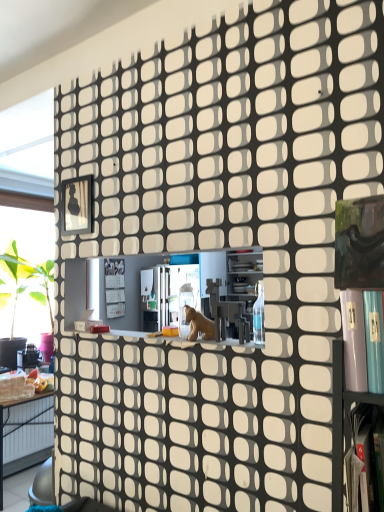
Question: Should I look upward or downward to see metallic frame at upper left?

Choices:
 (A) down
 (B) up

Answer: (B)

Question: Does brown matte animal at center turn towards metallic frame at upper left?

Choices:
 (A) no
 (B) yes

Answer: (A)

Question: Is brown matte animal at center placed right next to metallic frame at upper left?

Choices:
 (A) no
 (B) yes

Answer: (A)

Question: Does brown matte animal at center appear on the right side of metallic frame at upper left?

Choices:
 (A) yes
 (B) no

Answer: (A)

Question: Could metallic frame at upper left be considered to be inside brown matte animal at center?

Choices:
 (A) no
 (B) yes

Answer: (A)

Question: Is brown matte animal at center smaller than metallic frame at upper left?

Choices:
 (A) no
 (B) yes

Answer: (A)

Question: Is there a large distance between brown matte animal at center and metallic frame at upper left?

Choices:
 (A) no
 (B) yes

Answer: (A)

Question: Considering the relative sizes of metallic silver shelf at lower right and metallic frame at upper left in the image provided, is metallic silver shelf at lower right shorter than metallic frame at upper left?

Choices:
 (A) no
 (B) yes

Answer: (A)

Question: Is the surface of metallic silver shelf at lower right in direct contact with metallic frame at upper left?

Choices:
 (A) no
 (B) yes

Answer: (A)

Question: From the image's perspective, does metallic silver shelf at lower right appear lower than metallic frame at upper left?

Choices:
 (A) no
 (B) yes

Answer: (B)

Question: Considering the relative sizes of metallic silver shelf at lower right and metallic frame at upper left in the image provided, is metallic silver shelf at lower right smaller than metallic frame at upper left?

Choices:
 (A) yes
 (B) no

Answer: (B)

Question: Is metallic frame at upper left completely or partially inside metallic silver shelf at lower right?

Choices:
 (A) no
 (B) yes

Answer: (A)

Question: Can you confirm if metallic silver shelf at lower right is positioned to the right of metallic frame at upper left?

Choices:
 (A) no
 (B) yes

Answer: (B)

Question: From a real-world perspective, is metallic silver shelf at lower right beneath brown matte animal at center?

Choices:
 (A) yes
 (B) no

Answer: (A)